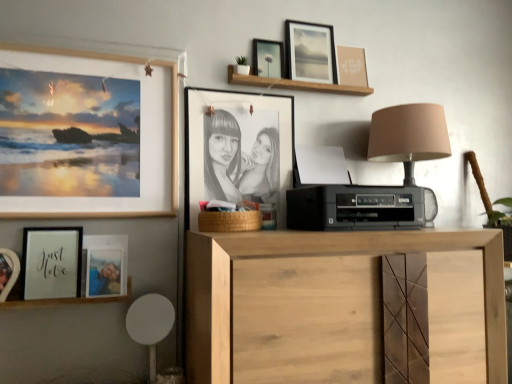
Question: Considering the positions of matte black frame at upper center, which is counted as the 6th picture frame, starting from the left, and wooden picture frame at upper left, which ranks as the 6th picture frame in right-to-left order, in the image, is matte black frame at upper center, which is counted as the 6th picture frame, starting from the left, wider or thinner than wooden picture frame at upper left, which ranks as the 6th picture frame in right-to-left order,?

Choices:
 (A) wide
 (B) thin

Answer: (B)

Question: From a real-world perspective, is matte black frame at upper center, which is counted as the 6th picture frame, starting from the left, physically located above or below wooden picture frame at upper left, placed as the 3th picture frame when sorted from left to right?

Choices:
 (A) below
 (B) above

Answer: (B)

Question: Estimate the real-world distances between objects in this image. Which object is closer to the matte black photo frame at center, which ranks as the 4th picture frame in right-to-left order?

Choices:
 (A) black plastic printer at center
 (B) natural wood cabinet at center
 (C) matte black picture frame at upper center, arranged as the second picture frame when viewed from the right
 (D) matte black picture frame at lower left, the 1th picture frame positioned from the left
 (E) matte black frame at lower left, which ranks as the seventh picture frame in right-to-left order

Answer: (A)

Question: Estimate the real-world distances between objects in this image. Which object is farther from the black plastic printer at center?

Choices:
 (A) wooden shelf at upper center, marked as the first shelf in a right-to-left arrangement
 (B) natural wood cabinet at center
 (C) matte black frame at upper center, the 3th picture frame viewed from the right
 (D) matte wooden photo frame at lower left, positioned as the fourth picture frame in left-to-right order
 (E) wooden frame at lower left, the 1th shelf positioned from the bottom

Answer: (E)